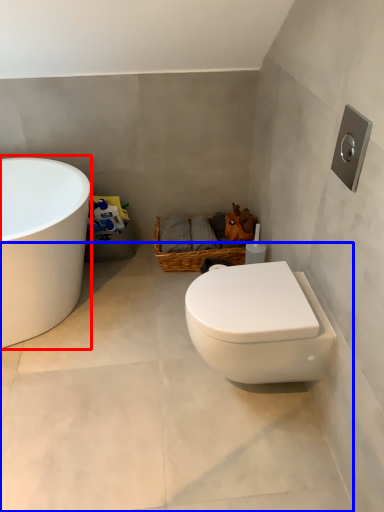
Question: Which object is closer to the camera taking this photo, bathtub (highlighted by a red box) or concrete (highlighted by a blue box)?

Choices:
 (A) bathtub
 (B) concrete

Answer: (B)